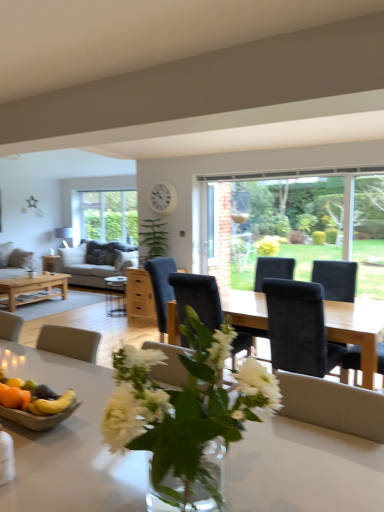
This screenshot has width=384, height=512. Identify the location of yellow matte bananas at lower left. [x=52, y=404].

From the picture: What is the approximate width of suede black chair at center?

suede black chair at center is 28.46 inches wide.

What do you see at coordinates (69, 444) in the screenshot?
I see `white glossy table at center` at bounding box center [69, 444].

In order to click on green leafy plant at center in this screenshot , I will do `click(153, 239)`.

Choose the correct answer: Is matte wooden coffee table at center, the 1th coffee table positioned from the front, inside yellow matte bananas at lower left or outside it?

matte wooden coffee table at center, the 1th coffee table positioned from the front, exists outside the volume of yellow matte bananas at lower left.

Considering the sizes of objects matte wooden coffee table at center, positioned as the 2th coffee table in left-to-right order, and yellow matte bananas at lower left in the image provided, who is wider, matte wooden coffee table at center, positioned as the 2th coffee table in left-to-right order, or yellow matte bananas at lower left?

matte wooden coffee table at center, positioned as the 2th coffee table in left-to-right order.

Is matte wooden coffee table at center, the second coffee table positioned from the back, facing towards yellow matte bananas at lower left?

No, matte wooden coffee table at center, the second coffee table positioned from the back, is not oriented towards yellow matte bananas at lower left.

From the picture: Looking at the image, does matte wooden coffee table at center, the second coffee table positioned from the back, seem bigger or smaller compared to yellow matte bananas at lower left?

matte wooden coffee table at center, the second coffee table positioned from the back, is bigger than yellow matte bananas at lower left.

Choose the correct answer: Is white plastic clock at upper center inside suede-like gray pillow at center or outside it?

white plastic clock at upper center is spatially situated outside suede-like gray pillow at center.

Relative to suede-like gray pillow at center, is white plastic clock at upper center in front or behind?

Visually, white plastic clock at upper center is located in front of suede-like gray pillow at center.

Which of these two, white plastic clock at upper center or suede-like gray pillow at center, is bigger?

With larger size is suede-like gray pillow at center.

From the image's perspective, is white plastic clock at upper center on green leafy plant at center?

Yes, from the image's perspective, white plastic clock at upper center is above green leafy plant at center.

Between white plastic clock at upper center and green leafy plant at center, which one has larger size?

Bigger between the two is green leafy plant at center.

Can you see white plastic clock at upper center touching green leafy plant at center?

white plastic clock at upper center is not next to green leafy plant at center, and they're not touching.

Can white plastic clock at upper center be found inside light gray fabric couch at center-left, positioned as the first studio couch in right-to-left order?

No, light gray fabric couch at center-left, positioned as the first studio couch in right-to-left order, does not contain white plastic clock at upper center.

Which point is more distant from viewer, (96, 259) or (170, 190)?

The point (96, 259) is more distant.

From the image's perspective, is light gray fabric couch at center-left, positioned as the first studio couch in right-to-left order, over white plastic clock at upper center?

Incorrect, from the image's perspective, light gray fabric couch at center-left, positioned as the first studio couch in right-to-left order, is lower than white plastic clock at upper center.

Is green leafy plant at center oriented towards light gray fabric couch at center-left, positioned as the first studio couch in right-to-left order?

No, green leafy plant at center is not oriented towards light gray fabric couch at center-left, positioned as the first studio couch in right-to-left order.

Would you say green leafy plant at center is a long distance from light gray fabric couch at center-left, positioned as the first studio couch in right-to-left order?

Yes.

From the image's perspective, count 2nd studio couchs downward from the green leafy plant at center and point to it. Please provide its 2D coordinates.

[(95, 262)]

From a real-world perspective, is green leafy plant at center physically located above or below light gray fabric couch at center-left, acting as the 2th studio couch starting from the left?

In terms of real-world spatial position, green leafy plant at center is above light gray fabric couch at center-left, acting as the 2th studio couch starting from the left.

From the image's perspective, is light brown wooden coffee table at left, which ranks as the second coffee table in front-to-back order, beneath suede-like gray pillow at center?

Yes, from the image's perspective, light brown wooden coffee table at left, which ranks as the second coffee table in front-to-back order, is below suede-like gray pillow at center.

From a real-world perspective, which object stands above the other?

suede-like gray pillow at center is physically above.

In the image, is light brown wooden coffee table at left, the first coffee table when ordered from left to right, positioned in front of or behind suede-like gray pillow at center?

Visually, light brown wooden coffee table at left, the first coffee table when ordered from left to right, is located in front of suede-like gray pillow at center.

From the picture: In terms of width, does light gray fabric couch at center-left, positioned as the first studio couch in right-to-left order, look wider or thinner when compared to wooden bowl of fruit at lower left?

Clearly, light gray fabric couch at center-left, positioned as the first studio couch in right-to-left order, has more width compared to wooden bowl of fruit at lower left.

Would you say light gray fabric couch at center-left, acting as the 2th studio couch starting from the left, contains wooden bowl of fruit at lower left?

No, wooden bowl of fruit at lower left is not surrounded by light gray fabric couch at center-left, acting as the 2th studio couch starting from the left.

Considering the relative sizes of light gray fabric couch at center-left, positioned as the first studio couch in right-to-left order, and wooden bowl of fruit at lower left in the image provided, is light gray fabric couch at center-left, positioned as the first studio couch in right-to-left order, bigger than wooden bowl of fruit at lower left?

Yes, light gray fabric couch at center-left, positioned as the first studio couch in right-to-left order, is bigger than wooden bowl of fruit at lower left.

This screenshot has width=384, height=512. Find the location of `the 1st studio couch behind when counting from the wooden bowl of fruit at lower left`. the 1st studio couch behind when counting from the wooden bowl of fruit at lower left is located at coordinates (95, 262).

Locate an element on the screen. This screenshot has width=384, height=512. fruit that is above the matte wooden coffee table at center, the second coffee table positioned from the back (from the image's perspective) is located at coordinates (52, 404).

Image resolution: width=384 pixels, height=512 pixels. Identify the location of clock on the right of suede-like gray pillow at center. (163, 197).

Based on the photo, based on their spatial positions, is suede-like gray pillow at center or suede black chair at center closer to matte wooden coffee table at center, the second coffee table positioned from the back?

suede-like gray pillow at center lies closer to matte wooden coffee table at center, the second coffee table positioned from the back, than the other object.

Based on their spatial positions, is white plastic clock at upper center or white glossy table at center further from suede black chair at center?

The object further to suede black chair at center is white plastic clock at upper center.

Considering their positions, is light brown wooden coffee table at left, which ranks as the second coffee table in front-to-back order, positioned closer to suede-like gray pillow at center than suede black chair at center?

The object closer to suede-like gray pillow at center is light brown wooden coffee table at left, which ranks as the second coffee table in front-to-back order.

Based on their spatial positions, is wooden bowl of fruit at lower left or matte wooden coffee table at center, the second coffee table positioned from the back, closer to yellow matte bananas at lower left?

Based on the image, wooden bowl of fruit at lower left appears to be nearer to yellow matte bananas at lower left.

Which object lies nearer to the anchor point white plastic clock at upper center, matte wooden coffee table at center, positioned as the 2th coffee table in left-to-right order, or suede black chair at center?

The object closer to white plastic clock at upper center is matte wooden coffee table at center, positioned as the 2th coffee table in left-to-right order.

Estimate the real-world distances between objects in this image. Which object is closer to green leafy plant at center, light gray fabric couch at center-left, acting as the 2th studio couch starting from the left, or matte wooden coffee table at center, placed as the 1th coffee table when sorted from right to left?

matte wooden coffee table at center, placed as the 1th coffee table when sorted from right to left, lies closer to green leafy plant at center than the other object.

Looking at the image, which one is located further to matte gray fabric couch at left, which ranks as the 2th studio couch in right-to-left order, green leafy plant at center or matte wooden coffee table at center, the second coffee table positioned from the back?

Among the two, green leafy plant at center is located further to matte gray fabric couch at left, which ranks as the 2th studio couch in right-to-left order.

Which object lies further to the anchor point light brown wooden coffee table at left, the first coffee table when ordered from left to right, matte wooden coffee table at center, placed as the 1th coffee table when sorted from right to left, or clear glass window at center?

The object further to light brown wooden coffee table at left, the first coffee table when ordered from left to right, is clear glass window at center.

Where is `clock located between wooden bowl of fruit at lower left and matte wooden coffee table at center, the second coffee table positioned from the back, in the depth direction`? The image size is (384, 512). clock located between wooden bowl of fruit at lower left and matte wooden coffee table at center, the second coffee table positioned from the back, in the depth direction is located at coordinates (163, 197).

Where is `houseplant located between suede black chair at center and suede-like gray pillow at center in the depth direction`? The height and width of the screenshot is (512, 384). houseplant located between suede black chair at center and suede-like gray pillow at center in the depth direction is located at coordinates (153, 239).

Locate an element on the screen. houseplant between wooden bowl of fruit at lower left and white plastic clock at upper center from front to back is located at coordinates (153, 239).

Where is `houseplant positioned between wooden bowl of fruit at lower left and matte wooden coffee table at center, the 1th coffee table positioned from the front, from near to far`? The height and width of the screenshot is (512, 384). houseplant positioned between wooden bowl of fruit at lower left and matte wooden coffee table at center, the 1th coffee table positioned from the front, from near to far is located at coordinates (153, 239).